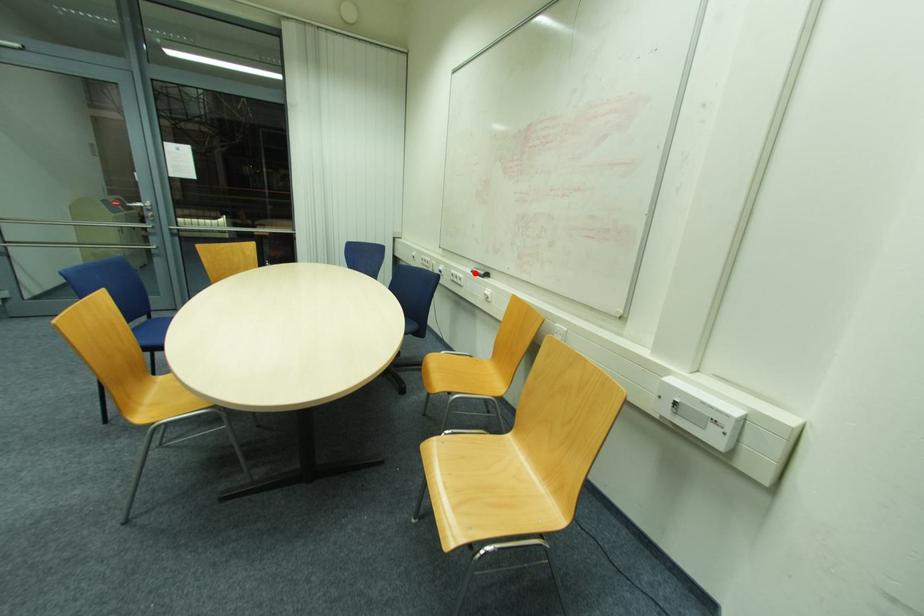
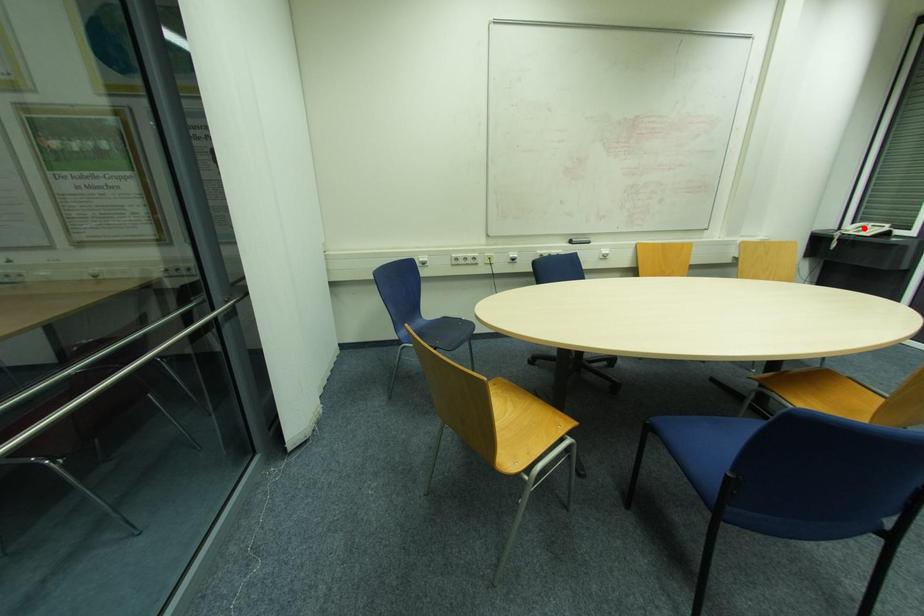
I am providing you with two images of the same scene from different viewpoints. A red point is marked on the first image and another point is marked on the second image. Is the marked point in image1 the same physical position as the marked point in image2?

No